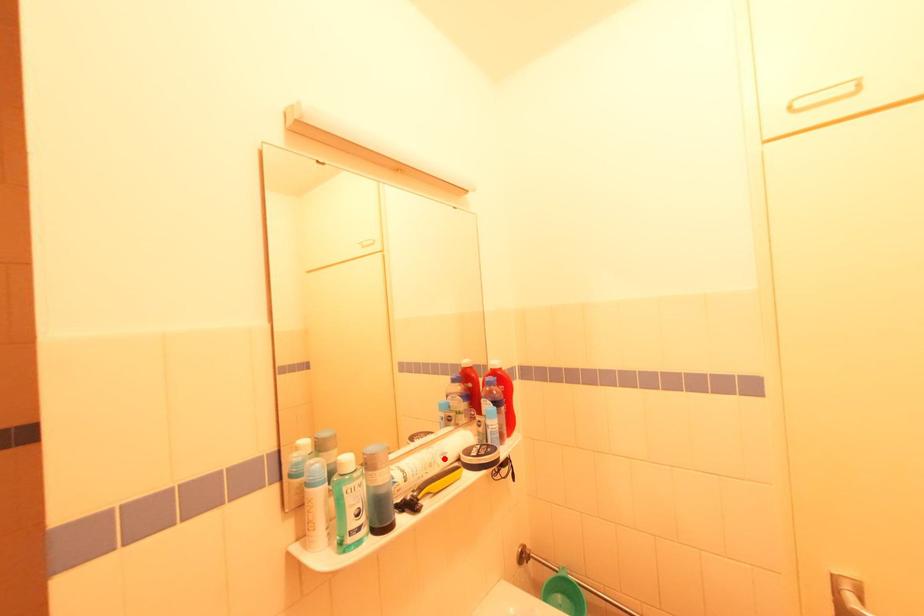
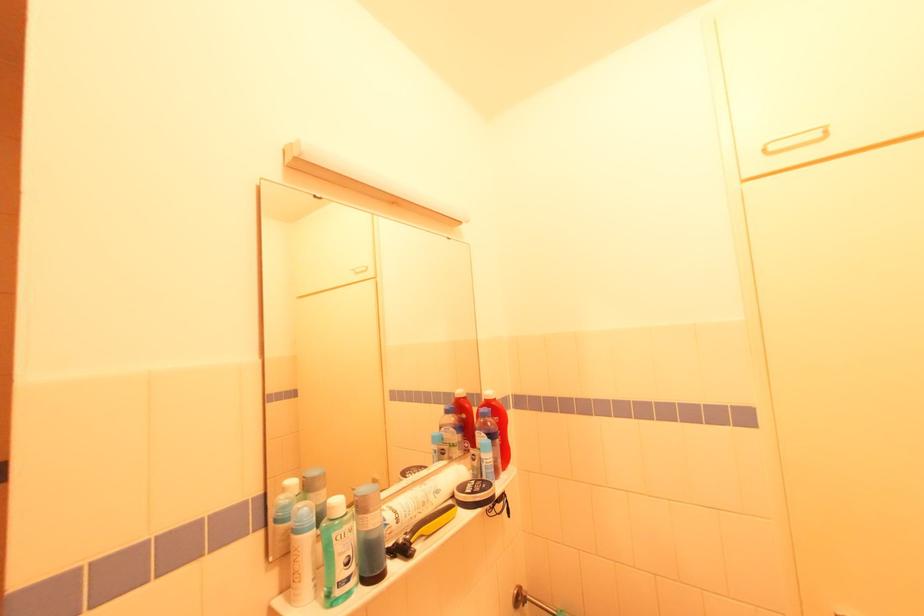
In the second image, find the point that corresponds to the highlighted location in the first image.

(438, 496)